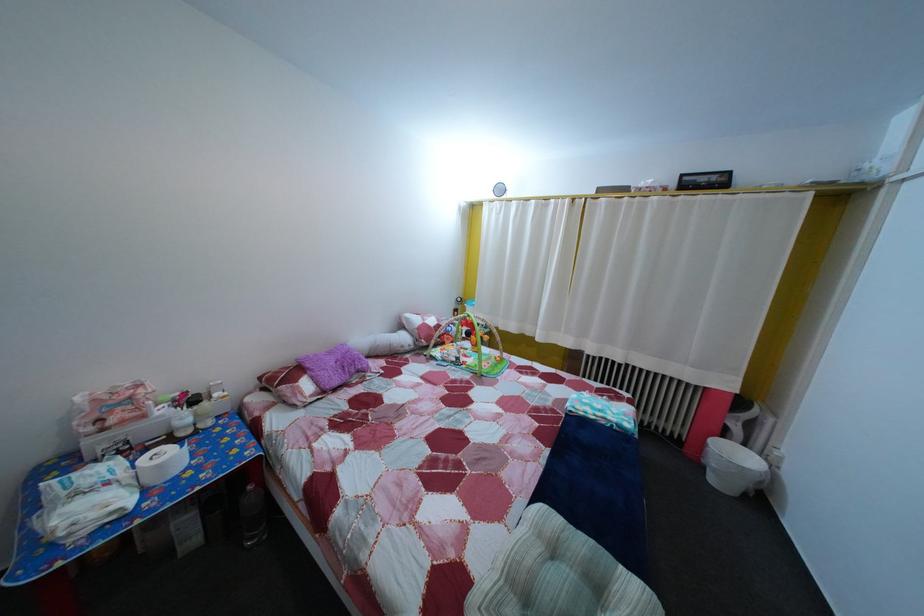
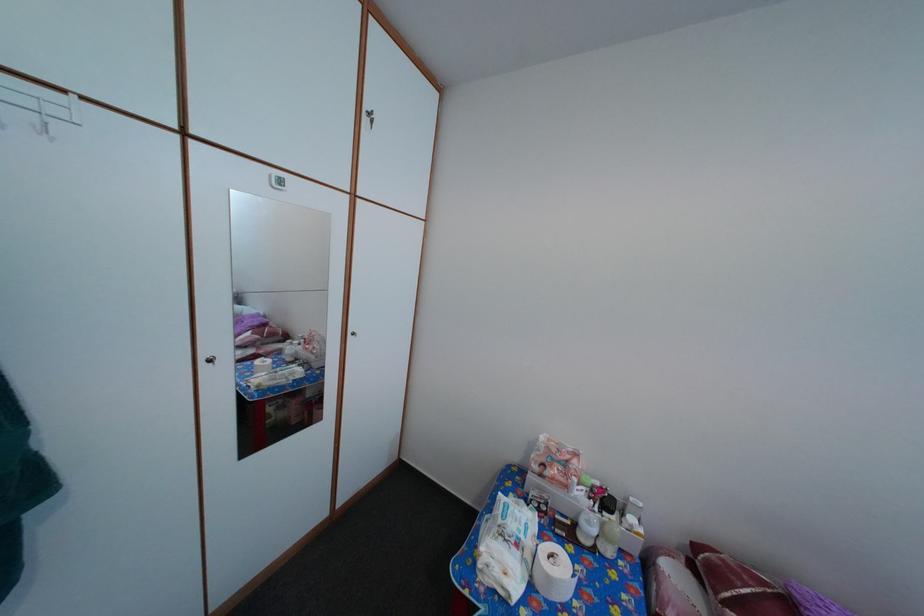
Locate, in the second image, the point that corresponds to the point at 140,406 in the first image.

(576, 469)